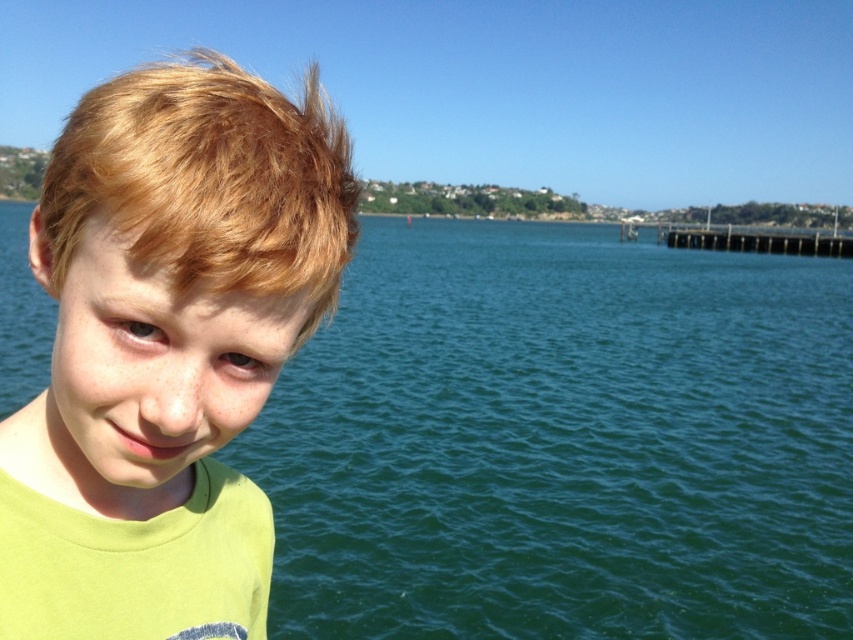
Question: Can you confirm if blonde hair at left is smaller than wooden pier at right?

Choices:
 (A) yes
 (B) no

Answer: (B)

Question: Does light green t-shirt at left have a larger size compared to blonde hair at left?

Choices:
 (A) no
 (B) yes

Answer: (A)

Question: Observing the image, what is the correct spatial positioning of blonde hair at left in reference to wooden pier at right?

Choices:
 (A) right
 (B) left

Answer: (B)

Question: Considering the real-world distances, which object is farthest from the blonde hair at left?

Choices:
 (A) light green t-shirt at left
 (B) wooden pier at right

Answer: (B)

Question: Which point appears closest to the camera in this image?

Choices:
 (A) (222, 488)
 (B) (842, 257)
 (C) (361, 404)

Answer: (A)

Question: Which point is farther to the camera?

Choices:
 (A) blonde hair at left
 (B) wooden pier at right

Answer: (B)